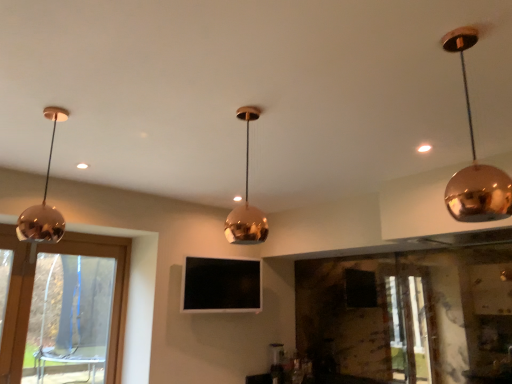
Question: From the image's perspective, is transparent glass window at left located above shiny copper pendant light at left, positioned as the third lamp in right-to-left order?

Choices:
 (A) no
 (B) yes

Answer: (A)

Question: Is transparent glass window at left taller than shiny copper pendant light at left, positioned as the third lamp in right-to-left order?

Choices:
 (A) no
 (B) yes

Answer: (B)

Question: Would you say transparent glass window at left is a long distance from shiny copper pendant light at left, positioned as the third lamp in right-to-left order?

Choices:
 (A) no
 (B) yes

Answer: (B)

Question: Could you tell me if transparent glass window at left is turned towards shiny copper pendant light at left, positioned as the third lamp in right-to-left order?

Choices:
 (A) yes
 (B) no

Answer: (A)

Question: From the image's perspective, is transparent glass window at left under shiny copper pendant light at left, acting as the first lamp starting from the left?

Choices:
 (A) yes
 (B) no

Answer: (A)

Question: Would you say transparent glass window at left is outside shiny copper pendant light at left, positioned as the third lamp in right-to-left order?

Choices:
 (A) no
 (B) yes

Answer: (B)

Question: Are transparent glass window at left and matte white light at upper right making contact?

Choices:
 (A) yes
 (B) no

Answer: (B)

Question: From the image's perspective, is transparent glass window at left beneath matte white light at upper right?

Choices:
 (A) yes
 (B) no

Answer: (A)

Question: Is transparent glass window at left oriented towards matte white light at upper right?

Choices:
 (A) yes
 (B) no

Answer: (A)

Question: Does transparent glass window at left have a greater width compared to matte white light at upper right?

Choices:
 (A) no
 (B) yes

Answer: (A)

Question: Does transparent glass window at left have a lesser height compared to matte white light at upper right?

Choices:
 (A) no
 (B) yes

Answer: (A)

Question: Is transparent glass window at left bigger than matte white light at upper right?

Choices:
 (A) no
 (B) yes

Answer: (B)

Question: From the image's perspective, would you say polished copper pendant light at center, which is counted as the second lamp, starting from the right, is positioned over shiny copper pendant light at left, acting as the first lamp starting from the left?

Choices:
 (A) yes
 (B) no

Answer: (B)